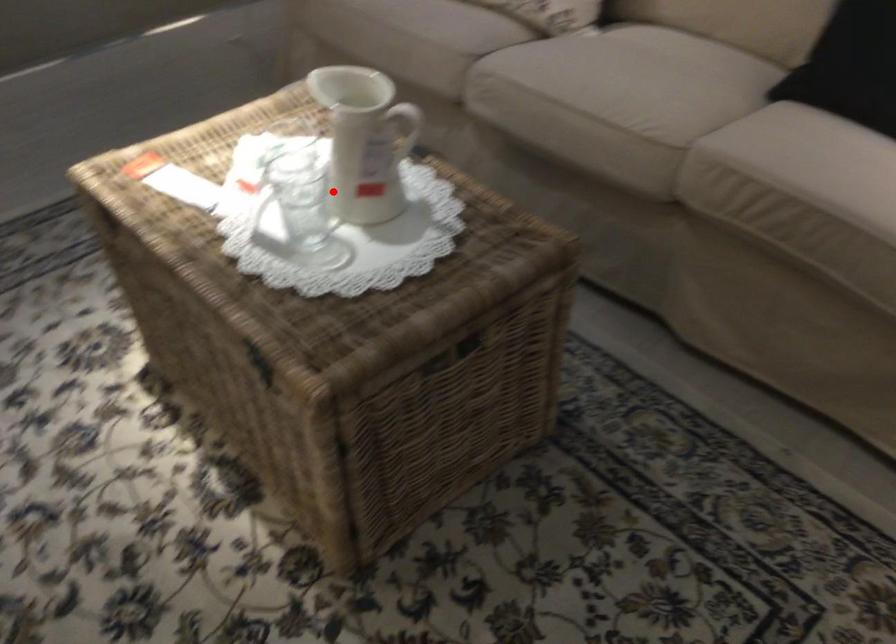
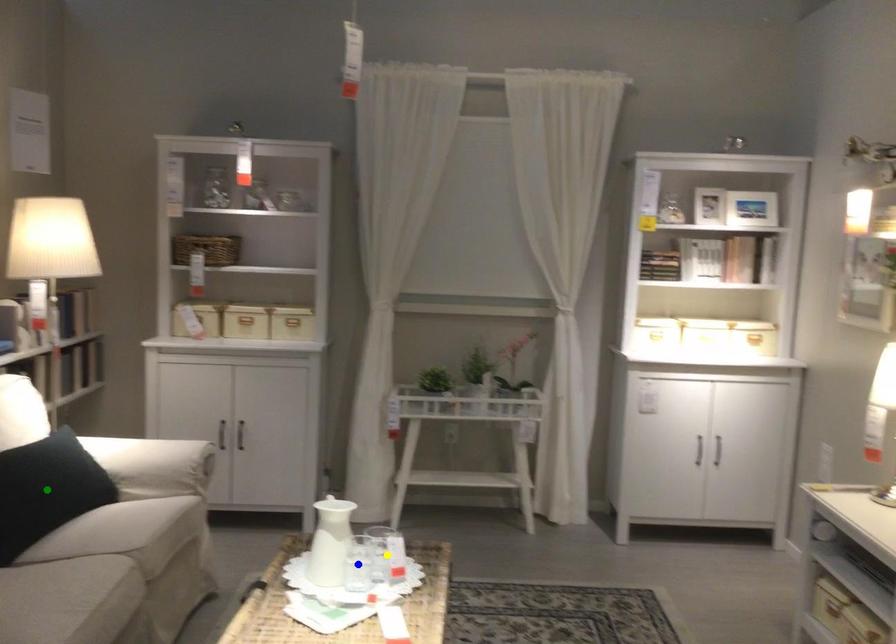
Question: I am providing you with two images of the same scene from different viewpoints. A red point is marked on the first image. You are given multiple points on the second image. Which mark in image 2 goes with the point in image 1?

Choices:
 (A) green point
 (B) blue point
 (C) yellow point

Answer: (B)